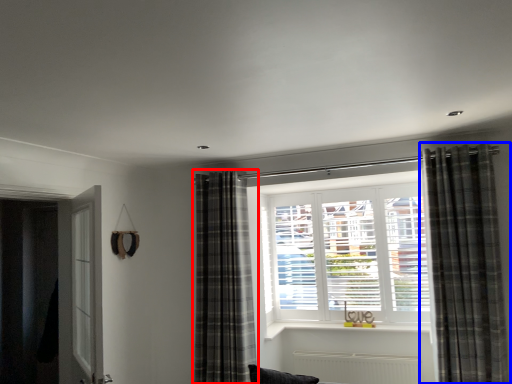
Question: Which object appears closest to the camera in this image, curtain (highlighted by a red box) or curtain (highlighted by a blue box)?

Choices:
 (A) curtain
 (B) curtain

Answer: (B)